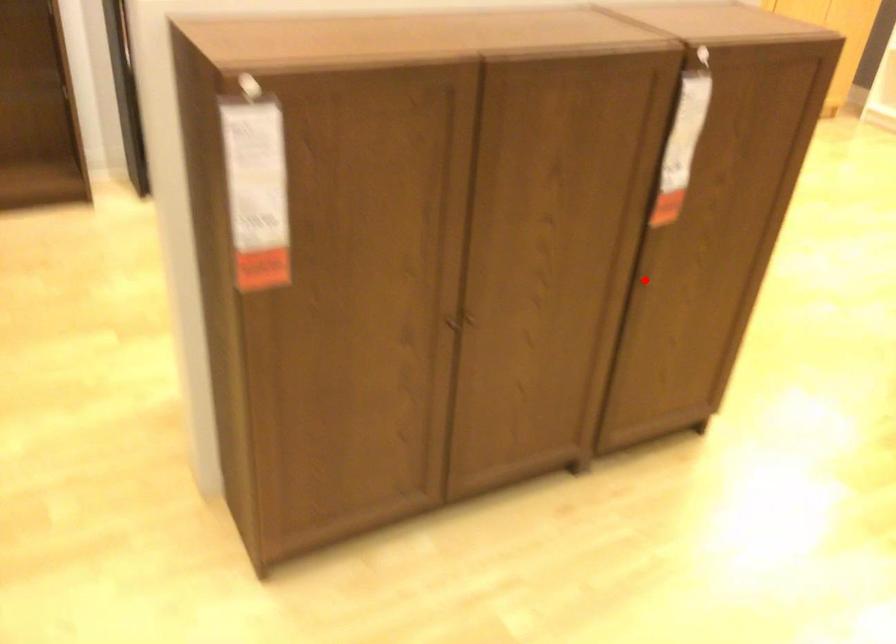
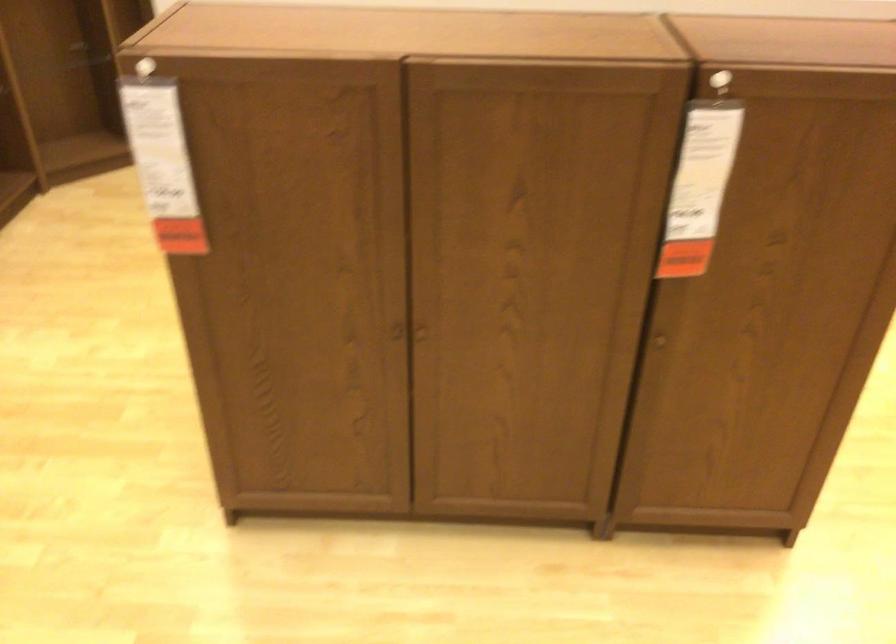
In the second image, find the point that corresponds to the highlighted location in the first image.

(659, 341)